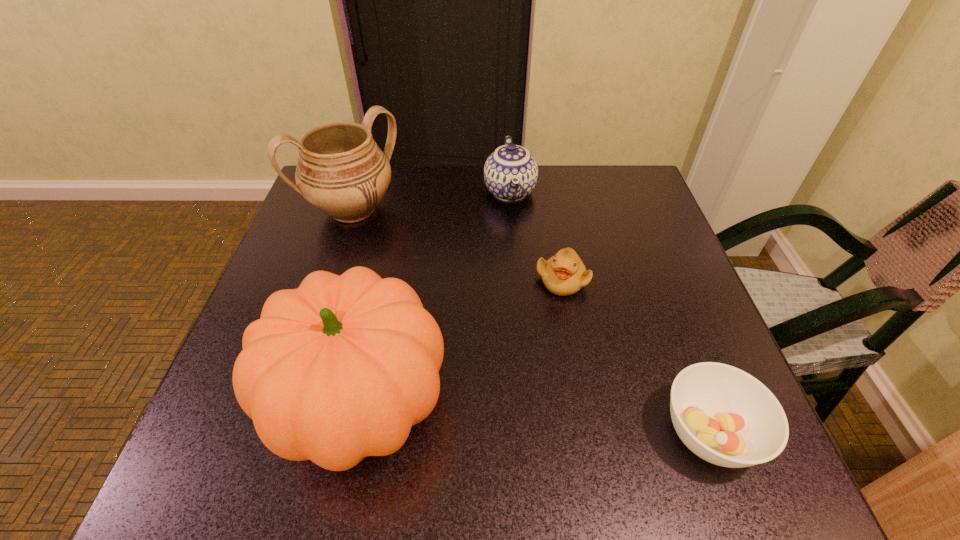
At what (x,y) coordinates should I click in order to perform the action: click on pumpkin at the left edge. Please return your answer as a coordinate pair (x, y). The image size is (960, 540). Looking at the image, I should click on (341, 368).

Image resolution: width=960 pixels, height=540 pixels. I want to click on urn that is at the left edge, so click(341, 171).

This screenshot has height=540, width=960. What are the coordinates of `object that is at the right edge` in the screenshot? It's located at (727, 417).

Find the location of a particular element. The image size is (960, 540). object that is at the far left corner is located at coordinates (341, 171).

The image size is (960, 540). I want to click on object that is at the near left corner, so click(x=341, y=368).

What are the coordinates of `object positioned at the near right corner` in the screenshot? It's located at (727, 417).

This screenshot has height=540, width=960. I want to click on blank space at the far edge, so pyautogui.click(x=397, y=168).

Where is `free region at the left edge`? Image resolution: width=960 pixels, height=540 pixels. free region at the left edge is located at coordinates (268, 293).

Where is `free space at the right edge of the desktop`? The image size is (960, 540). free space at the right edge of the desktop is located at coordinates (x=608, y=255).

Identify the location of vacant space at the near left corner of the desktop. The image size is (960, 540). (217, 399).